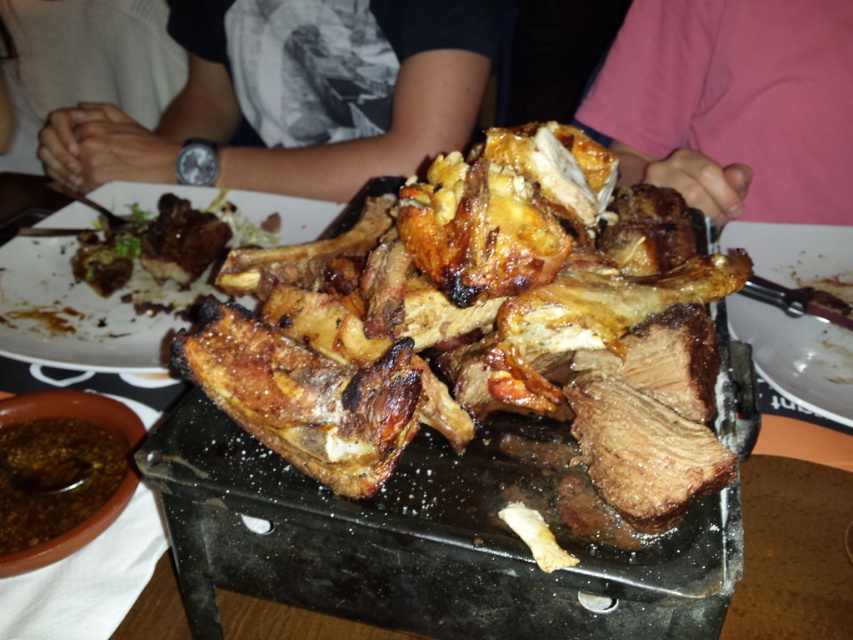
You are a customer at a restaurant and you see the black printed shirt at upper center and the brown charred meat at center on the table. Which object is higher in height?

The black printed shirt at upper center is taller than the brown charred meat at center.

You are a food critic who just arrived at the restaurant and see the brown charred meat at center and the brown glossy sauce at lower left on the tray. Which item is positioned higher up on the tray?

The brown charred meat at center is located above the brown glossy sauce at lower left, so it is positioned higher up on the tray.

You are a waiter who needs to place a customer order on the table. The customer ordered a roasted meat dish and a small sauce bowl. Where should you place the pink fabric at upper right relative to the other items on the table?

The pink fabric at upper right should be placed at the coordinates point (740,93) relative to the other items on the table.